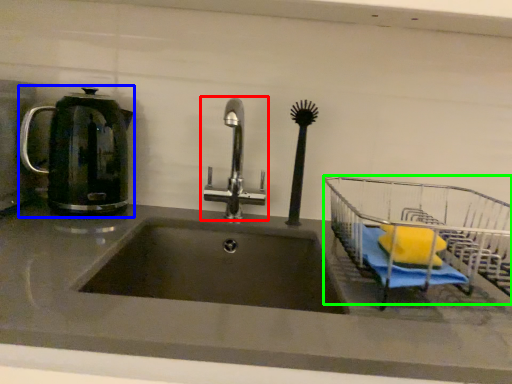
Question: Estimate the real-world distances between objects in this image. Which object is farther from tap (highlighted by a red box), kettle (highlighted by a blue box) or cart (highlighted by a green box)?

Choices:
 (A) kettle
 (B) cart

Answer: (B)